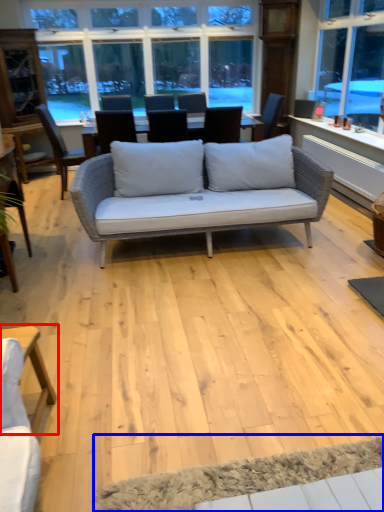
Question: Among these objects, which one is farthest to the camera, table (highlighted by a red box) or yoga mat (highlighted by a blue box)?

Choices:
 (A) table
 (B) yoga mat

Answer: (A)